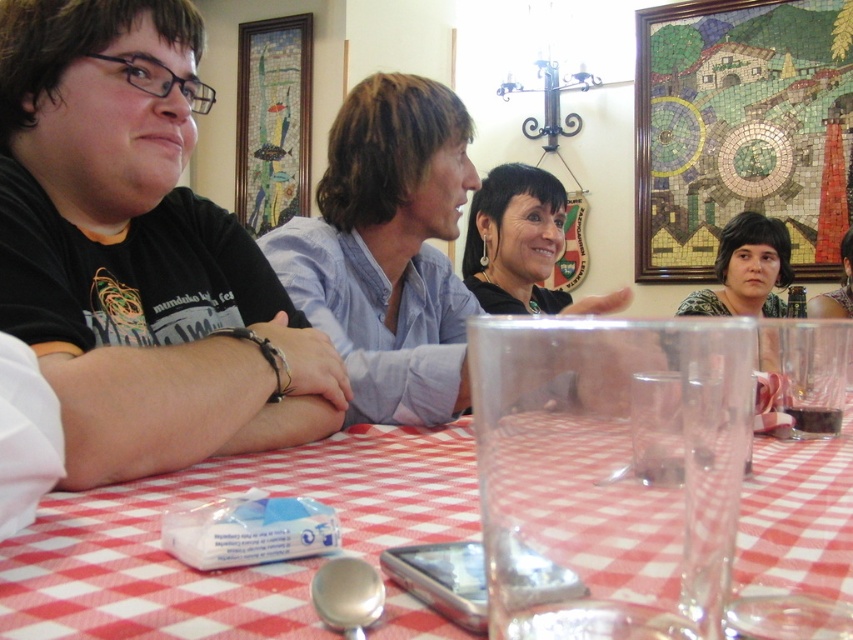
Question: Can you confirm if matte black hair at center is smaller than green floral blouse at center?

Choices:
 (A) no
 (B) yes

Answer: (A)

Question: Does red checkered tablecloth at center have a lesser width compared to matte black hair at center?

Choices:
 (A) no
 (B) yes

Answer: (A)

Question: Which object is the closest to the matte black hair at center?

Choices:
 (A) red checkered tablecloth at center
 (B) green floral blouse at center
 (C) black matte shirt at left

Answer: (C)

Question: Estimate the real-world distances between objects in this image. Which object is farther from the matte black hair at center?

Choices:
 (A) red checkered tablecloth at center
 (B) green floral blouse at center
 (C) black matte shirt at left

Answer: (B)

Question: Is black matte shirt at left to the right of green floral blouse at center from the viewer's perspective?

Choices:
 (A) yes
 (B) no

Answer: (B)

Question: Which object is the farthest from the black matte shirt at left?

Choices:
 (A) matte black hair at center
 (B) green floral blouse at center
 (C) red checkered tablecloth at center

Answer: (B)